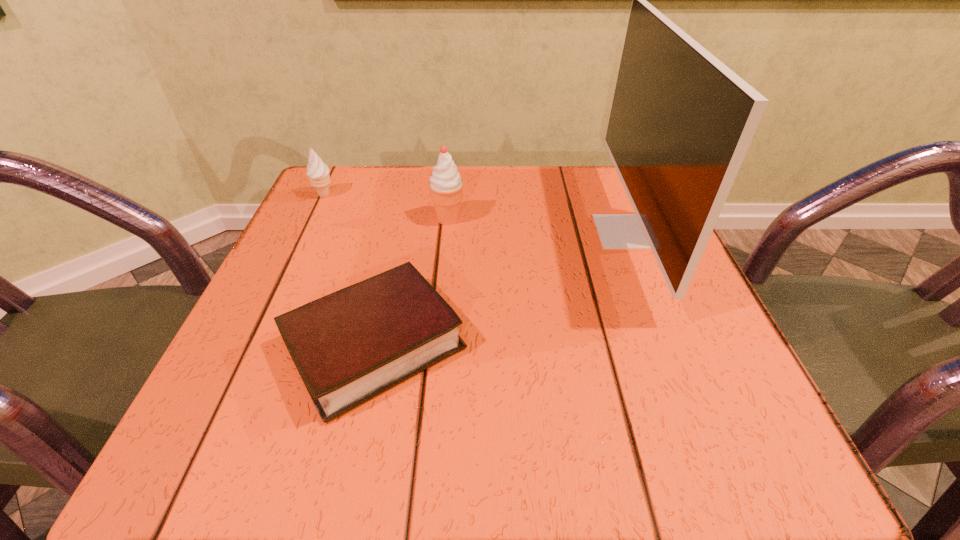
I want to click on object that is positioned at the far right corner, so [x=681, y=122].

Locate an element on the screen. This screenshot has height=540, width=960. free location at the far edge is located at coordinates (421, 182).

In the image, there is a desktop. At what (x,y) coordinates should I click in order to perform the action: click on vacant space at the near edge. Please return your answer as a coordinate pair (x, y). This screenshot has width=960, height=540. Looking at the image, I should click on (483, 426).

You are a GUI agent. You are given a task and a screenshot of the screen. Output one action in this format:
    pyautogui.click(x=<x>, y=<y>)
    Task: Click on the vacant area at the left edge
    Image resolution: width=960 pixels, height=540 pixels.
    Given the screenshot: What is the action you would take?
    point(354,242)

The width and height of the screenshot is (960, 540). What are the coordinates of `blank space at the right edge of the desktop` in the screenshot? It's located at (609, 292).

The width and height of the screenshot is (960, 540). In order to click on free space at the far left corner of the desktop in this screenshot , I will do `click(337, 188)`.

Image resolution: width=960 pixels, height=540 pixels. In the image, there is a desktop. Identify the location of blank space at the near left corner. click(x=261, y=452).

In the image, there is a desktop. At what (x,y) coordinates should I click in order to perform the action: click on vacant space at the far right corner. Please return your answer as a coordinate pair (x, y). This screenshot has width=960, height=540. Looking at the image, I should click on (618, 202).

Where is `free space at the near right corner`? free space at the near right corner is located at coordinates (678, 421).

You are a GUI agent. You are given a task and a screenshot of the screen. Output one action in this format:
    pyautogui.click(x=<x>, y=<y>)
    Task: Click on the vacant point located between the shorter icecream and the nearer icecream
    The image size is (960, 540).
    Given the screenshot: What is the action you would take?
    pyautogui.click(x=386, y=207)